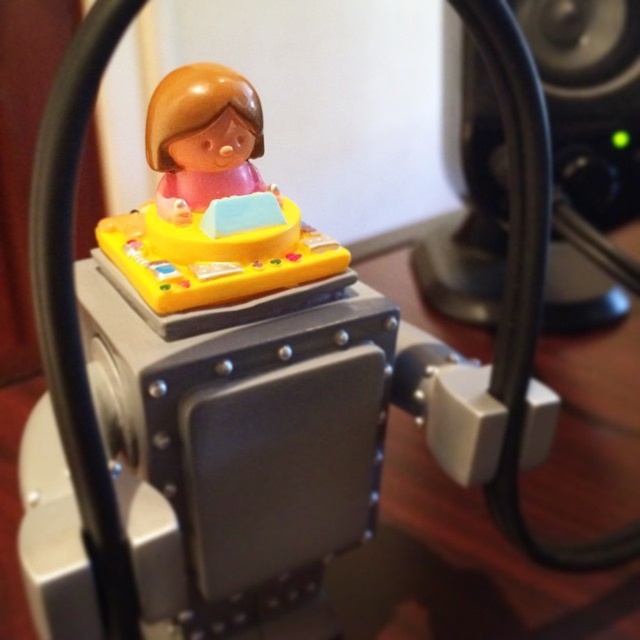
Can you confirm if black plastic speaker at upper right is positioned to the right of matte plastic figurine at center?

Yes, black plastic speaker at upper right is to the right of matte plastic figurine at center.

Between black plastic speaker at upper right and matte plastic figurine at center, which one has less height?

Standing shorter between the two is matte plastic figurine at center.

I want to click on black plastic speaker at upper right, so click(589, 99).